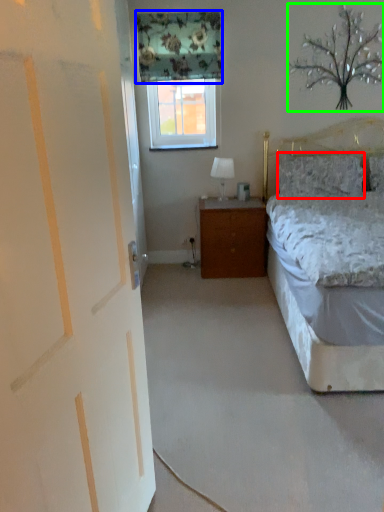
Question: Which object is the closest to the pillow (highlighted by a red box)? Choose among these: curtain (highlighted by a blue box) or tree (highlighted by a green box).

Choices:
 (A) curtain
 (B) tree

Answer: (B)